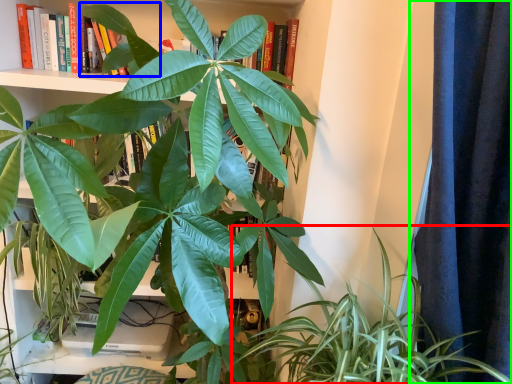
Question: Which object is positioned closest to houseplant (highlighted by a red box)? Select from leaf (highlighted by a blue box) and curtain (highlighted by a green box).

Choices:
 (A) leaf
 (B) curtain

Answer: (B)